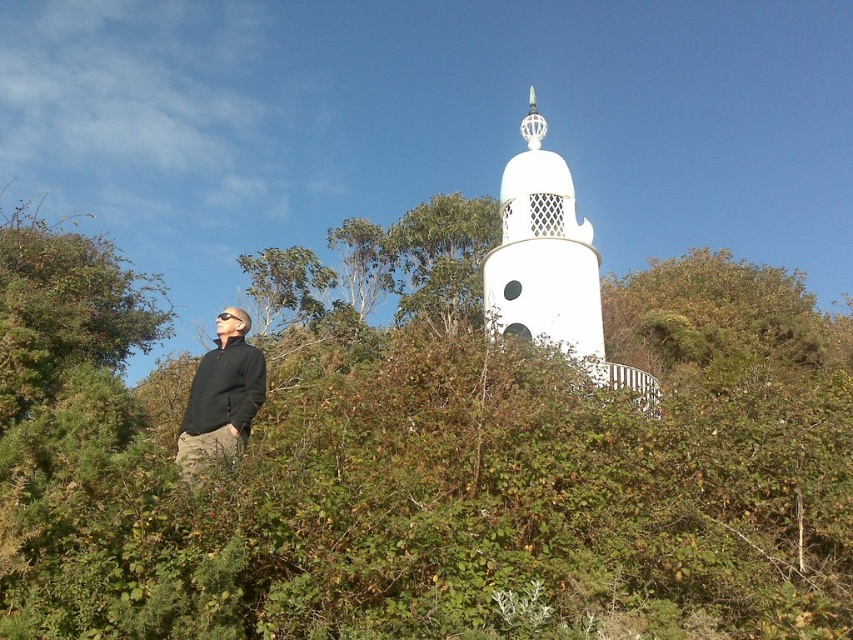
Question: Which object appears closest to the camera in this image?

Choices:
 (A) white matte tower at center
 (B) green leafy bush at center
 (C) black matte jacket at lower left

Answer: (B)

Question: Is green leafy bush at center further to camera compared to black matte jacket at lower left?

Choices:
 (A) no
 (B) yes

Answer: (A)

Question: Does white matte tower at center have a smaller size compared to black matte jacket at lower left?

Choices:
 (A) yes
 (B) no

Answer: (B)

Question: Among these points, which one is farthest from the camera?

Choices:
 (A) (221, 324)
 (B) (103, 284)

Answer: (B)

Question: Which object is closer to the camera taking this photo?

Choices:
 (A) white matte tower at center
 (B) black matte jacket at lower left

Answer: (B)

Question: Is white matte tower at center to the right of black matte jacket at lower left from the viewer's perspective?

Choices:
 (A) no
 (B) yes

Answer: (B)